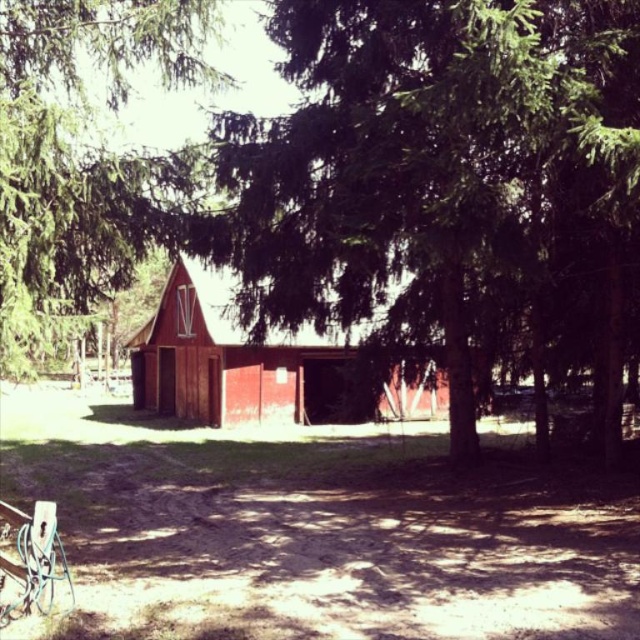
Can you confirm if green leafy tree at left is positioned below matte red barn at center?

Incorrect, green leafy tree at left is not positioned below matte red barn at center.

Measure the distance between point (x=26, y=253) and camera.

Point (x=26, y=253) is 9.38 meters from camera.

Where is `green leafy tree at left`? The image size is (640, 640). green leafy tree at left is located at coordinates (81, 156).

Find the location of a particular element. The width and height of the screenshot is (640, 640). green leafy tree at left is located at coordinates (81, 156).